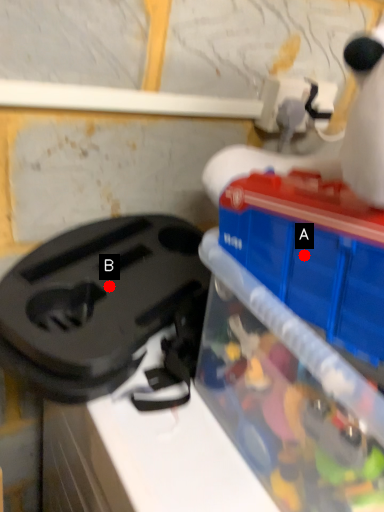
Question: Two points are circled on the image, labeled by A and B beside each circle. Among these points, which one is nearest to the camera?

Choices:
 (A) A is closer
 (B) B is closer

Answer: (A)